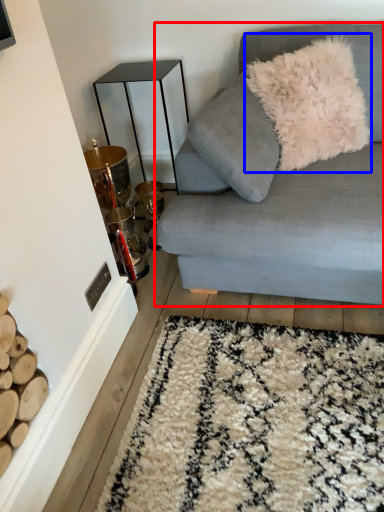
Question: Which object appears farthest to the camera in this image, studio couch (highlighted by a red box) or throw pillow (highlighted by a blue box)?

Choices:
 (A) studio couch
 (B) throw pillow

Answer: (B)